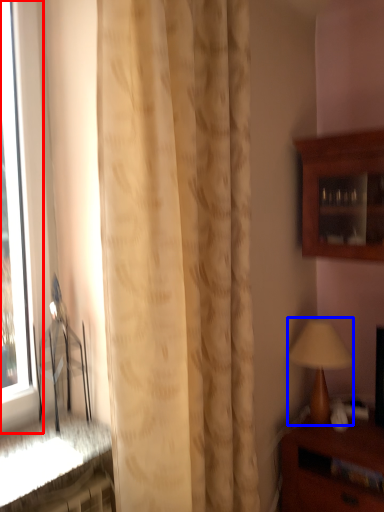
Question: Which object is further to the camera taking this photo, window (highlighted by a red box) or table lamp (highlighted by a blue box)?

Choices:
 (A) window
 (B) table lamp

Answer: (B)